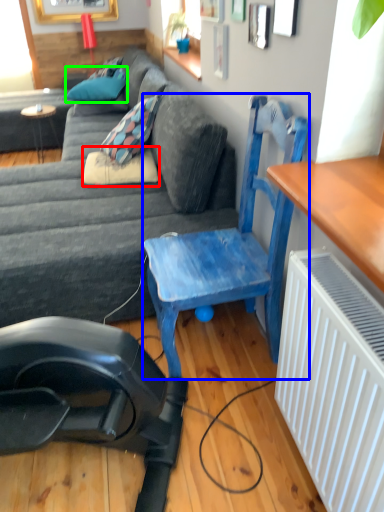
Question: Considering the real-world distances, which object is farthest from pillow (highlighted by a red box)? chair (highlighted by a blue box) or pillow (highlighted by a green box)?

Choices:
 (A) chair
 (B) pillow

Answer: (B)